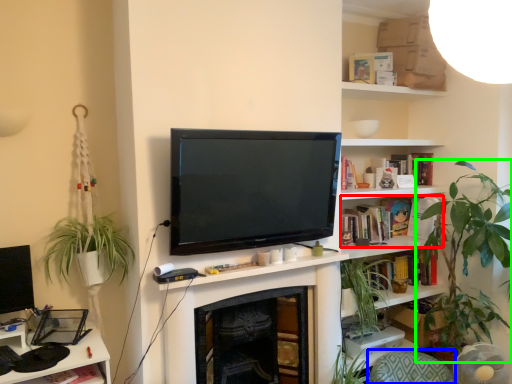
Question: Which object is positioned farthest from book (highlighted by a red box)? Select from swivel chair (highlighted by a blue box) and houseplant (highlighted by a green box).

Choices:
 (A) swivel chair
 (B) houseplant

Answer: (A)